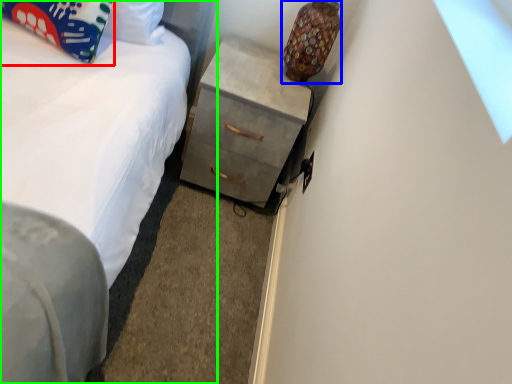
Question: Which object is the closest to the pillow (highlighted by a red box)? Choose among these: lamp (highlighted by a blue box) or bed (highlighted by a green box).

Choices:
 (A) lamp
 (B) bed

Answer: (B)